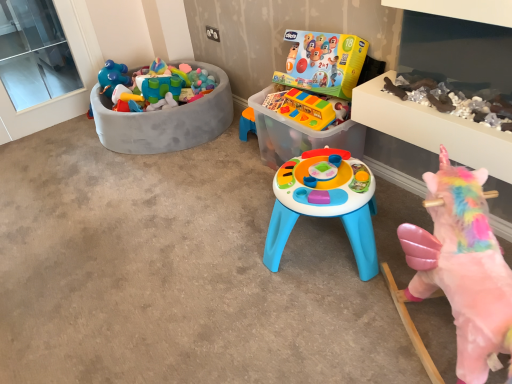
At what (x,y) coordinates should I click in order to perform the action: click on vacant space in front of transparent glass window at upper left. Please return your answer as a coordinate pair (x, y). This screenshot has height=384, width=512. Looking at the image, I should click on (73, 138).